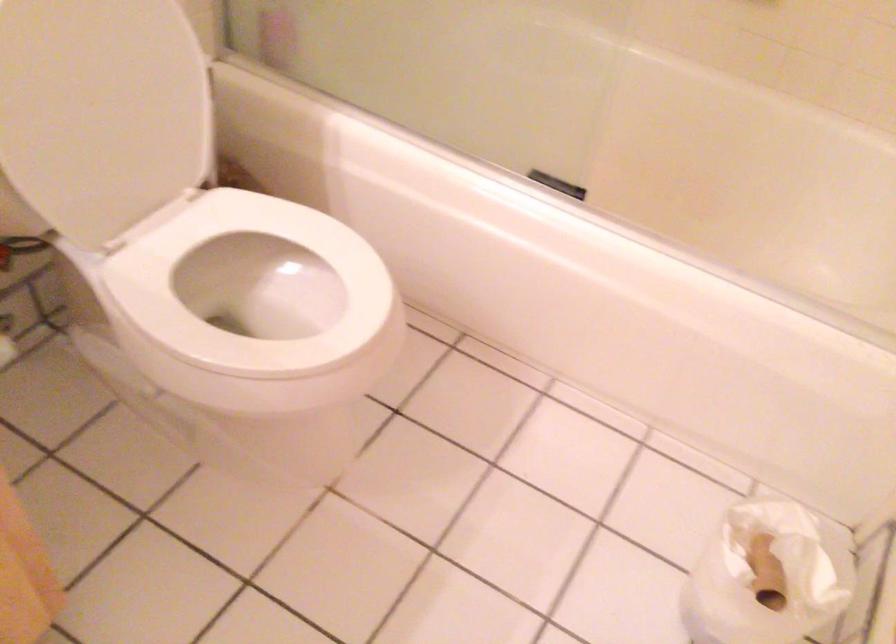
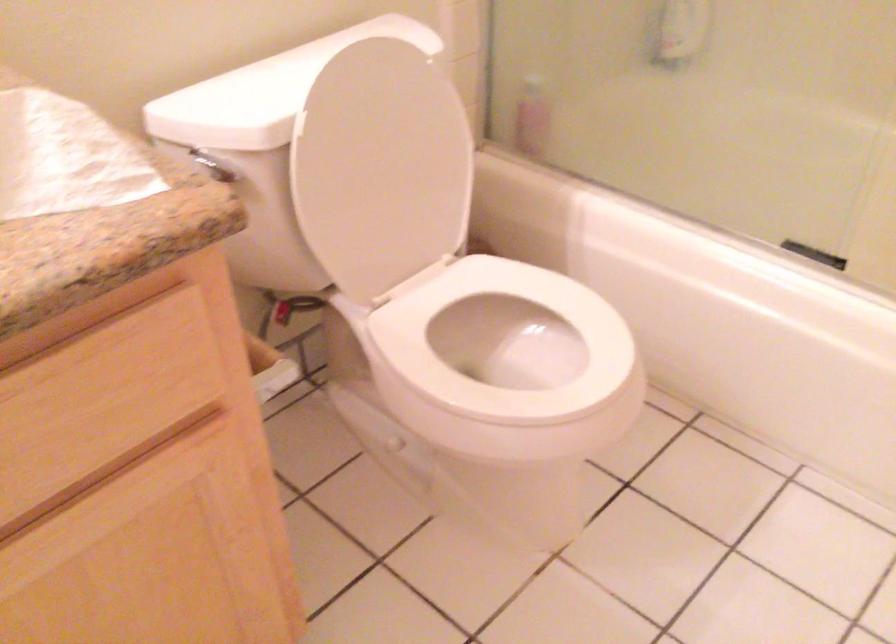
Question: I am providing you with two images of the same scene from different viewpoints. Which of the following objects are not visible in image2?

Choices:
 (A) silver flush lever
 (B) pink bottle
 (C) white toilet lid
 (D) none of these

Answer: (D)